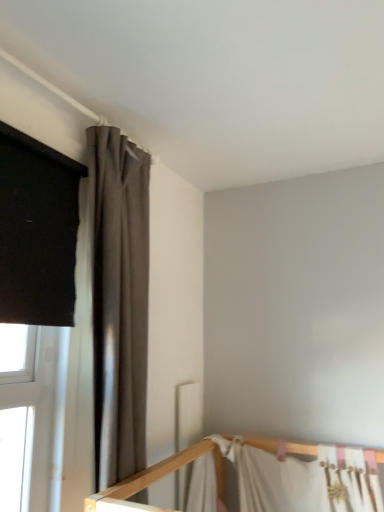
Describe the element at coordinates (119, 302) in the screenshot. I see `dark gray matte curtain at upper left` at that location.

Locate an element on the screen. dark gray matte curtain at upper left is located at coordinates (119, 302).

Measure the distance between point (264, 475) and camera.

They are 6.41 feet apart.

The image size is (384, 512). In order to click on white fabric bed at lower right in this screenshot , I will do `click(262, 479)`.

Describe the element at coordinates (262, 479) in the screenshot. I see `white fabric bed at lower right` at that location.

What are the coordinates of `dark gray matte curtain at upper left` in the screenshot? It's located at (119, 302).

Is dark gray matte curtain at upper left to the right of white fabric bed at lower right from the viewer's perspective?

Incorrect, dark gray matte curtain at upper left is not on the right side of white fabric bed at lower right.

Looking at this image, is the position of dark gray matte curtain at upper left less distant than that of white fabric bed at lower right?

That is True.

Between point (110, 290) and point (133, 487), which one is positioned behind?

The point (110, 290) is behind.

From the image's perspective, is dark gray matte curtain at upper left located above or below white fabric bed at lower right?

dark gray matte curtain at upper left is above white fabric bed at lower right.

Consider the image. From a real-world perspective, is dark gray matte curtain at upper left under white fabric bed at lower right?

No.

Can you confirm if dark gray matte curtain at upper left is thinner than white fabric bed at lower right?

No, dark gray matte curtain at upper left is not thinner than white fabric bed at lower right.

Between dark gray matte curtain at upper left and white fabric bed at lower right, which one has more height?

dark gray matte curtain at upper left.

Can you confirm if dark gray matte curtain at upper left is bigger than white fabric bed at lower right?

Yes, dark gray matte curtain at upper left is bigger than white fabric bed at lower right.

Which is correct: dark gray matte curtain at upper left is inside white fabric bed at lower right, or outside of it?

dark gray matte curtain at upper left is not inside white fabric bed at lower right, it's outside.

Would you say dark gray matte curtain at upper left is a long distance from white fabric bed at lower right?

dark gray matte curtain at upper left is actually quite close to white fabric bed at lower right.

Is white fabric bed at lower right at the back of dark gray matte curtain at upper left?

No, dark gray matte curtain at upper left's orientation is not away from white fabric bed at lower right.

How many degrees apart are the facing directions of dark gray matte curtain at upper left and white fabric bed at lower right?

The angular difference between dark gray matte curtain at upper left and white fabric bed at lower right is 88.8 degrees.

Where is `bed below the dark gray matte curtain at upper left (from the image's perspective)`? This screenshot has width=384, height=512. bed below the dark gray matte curtain at upper left (from the image's perspective) is located at coordinates (262, 479).

Can you confirm if white fabric bed at lower right is positioned to the left of dark gray matte curtain at upper left?

In fact, white fabric bed at lower right is to the right of dark gray matte curtain at upper left.

Relative to dark gray matte curtain at upper left, is white fabric bed at lower right in front or behind?

white fabric bed at lower right is positioned farther from the viewer than dark gray matte curtain at upper left.

Which is farther, (179,458) or (124,288)?

The point (179,458) is more distant.

From the image's perspective, is white fabric bed at lower right below dark gray matte curtain at upper left?

Correct, white fabric bed at lower right appears lower than dark gray matte curtain at upper left in the image.

From a real-world perspective, which is physically above, white fabric bed at lower right or dark gray matte curtain at upper left?

dark gray matte curtain at upper left.

Considering the sizes of white fabric bed at lower right and dark gray matte curtain at upper left in the image, is white fabric bed at lower right wider or thinner than dark gray matte curtain at upper left?

white fabric bed at lower right is thinner than dark gray matte curtain at upper left.

Between white fabric bed at lower right and dark gray matte curtain at upper left, which one has less height?

white fabric bed at lower right.

Between white fabric bed at lower right and dark gray matte curtain at upper left, which one has larger size?

dark gray matte curtain at upper left.

Looking at this image, does white fabric bed at lower right contain dark gray matte curtain at upper left?

No.

Does white fabric bed at lower right touch dark gray matte curtain at upper left?

No, white fabric bed at lower right is not beside dark gray matte curtain at upper left.

Is white fabric bed at lower right looking in the opposite direction of dark gray matte curtain at upper left?

No, white fabric bed at lower right is not facing away from dark gray matte curtain at upper left.

This screenshot has height=512, width=384. I want to click on bed located on the right of dark gray matte curtain at upper left, so click(x=262, y=479).

Locate an element on the screen. bed on the right of dark gray matte curtain at upper left is located at coordinates (262, 479).

Where is `bed beneath the dark gray matte curtain at upper left (from a real-world perspective)`? bed beneath the dark gray matte curtain at upper left (from a real-world perspective) is located at coordinates (262, 479).